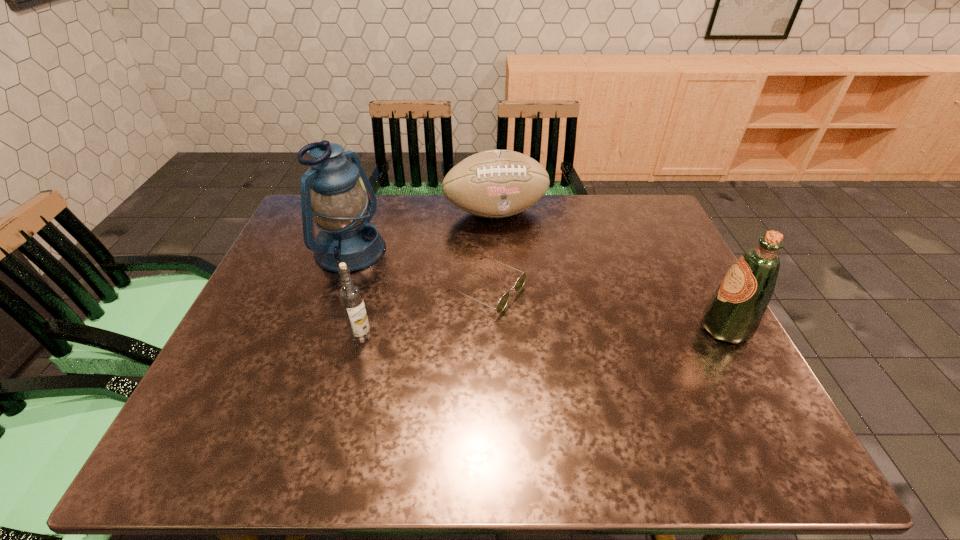
The image size is (960, 540). Find the location of `free space that is in between the football (American) and the vodka`. free space that is in between the football (American) and the vodka is located at coordinates (428, 274).

Identify the location of free space between the football (American) and the vodka. This screenshot has width=960, height=540. (428, 274).

This screenshot has width=960, height=540. Identify the location of free spot between the lantern and the football (American). (422, 233).

Where is `vacant point located between the football (American) and the vodka`? This screenshot has height=540, width=960. vacant point located between the football (American) and the vodka is located at coordinates (428, 274).

Image resolution: width=960 pixels, height=540 pixels. Find the location of `vacant area that lies between the second tallest object and the vodka`. vacant area that lies between the second tallest object and the vodka is located at coordinates (543, 333).

You are a GUI agent. You are given a task and a screenshot of the screen. Output one action in this format:
    pyautogui.click(x=<x>, y=<y>)
    Task: Click on the vacant space that's between the vodka and the fourth shortest object
    The width and height of the screenshot is (960, 540).
    Given the screenshot: What is the action you would take?
    pyautogui.click(x=543, y=333)

Image resolution: width=960 pixels, height=540 pixels. In order to click on free space that is in between the football (American) and the tallest object in this screenshot , I will do pyautogui.click(x=422, y=233).

Where is `object identified as the closest to the tallest object`? This screenshot has height=540, width=960. object identified as the closest to the tallest object is located at coordinates (350, 295).

Find the location of `the second closest object to the sunglasses`. the second closest object to the sunglasses is located at coordinates (350, 295).

Locate an element on the screen. Image resolution: width=960 pixels, height=540 pixels. vacant point that satisfies the following two spatial constraints: 1. on the front side of the olive oil; 2. on the front-facing side of the lantern is located at coordinates (324, 328).